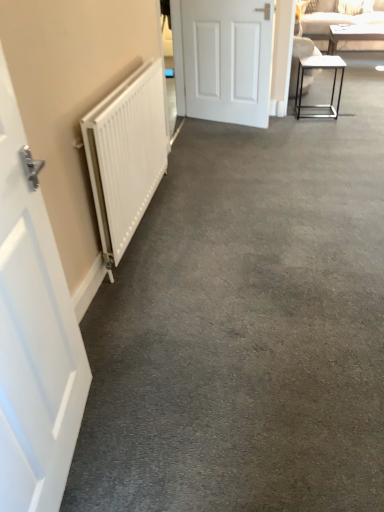
Question: Is white matte door at left, the 2th door when ordered from top to bottom, looking in the opposite direction of white glossy table at upper right, which is counted as the first table, starting from the top?

Choices:
 (A) no
 (B) yes

Answer: (A)

Question: Is white matte door at left, which is the 2th door in back-to-front order, smaller than white glossy table at upper right, the 1th table when ordered from back to front?

Choices:
 (A) no
 (B) yes

Answer: (B)

Question: Is white matte door at left, which is the second door in right-to-left order, bigger than white glossy table at upper right, which is the 2th table from bottom to top?

Choices:
 (A) yes
 (B) no

Answer: (B)

Question: Is white matte door at left, positioned as the 1th door in bottom-to-top order, not close to white glossy table at upper right, marked as the 1th table in a right-to-left arrangement?

Choices:
 (A) no
 (B) yes

Answer: (B)

Question: Does white matte door at left, which is the second door in right-to-left order, come behind white glossy table at upper right, the 2th table positioned from the front?

Choices:
 (A) yes
 (B) no

Answer: (B)

Question: Considering the positions of point (188, 74) and point (350, 45), is point (188, 74) closer or farther from the camera than point (350, 45)?

Choices:
 (A) farther
 (B) closer

Answer: (B)

Question: Considering the positions of white matte door at center, which appears as the second door when viewed from the left, and beige fabric couch at upper right in the image, is white matte door at center, which appears as the second door when viewed from the left, taller or shorter than beige fabric couch at upper right?

Choices:
 (A) tall
 (B) short

Answer: (A)

Question: Considering the positions of white matte door at center, placed as the second door when sorted from bottom to top, and beige fabric couch at upper right in the image, is white matte door at center, placed as the second door when sorted from bottom to top, bigger or smaller than beige fabric couch at upper right?

Choices:
 (A) big
 (B) small

Answer: (B)

Question: Is white matte door at center, the 2th door in the front-to-back sequence, inside or outside of beige fabric couch at upper right?

Choices:
 (A) outside
 (B) inside

Answer: (A)

Question: Is beige fabric couch at upper right spatially inside metallic frame table at right, the second table viewed from the right, or outside of it?

Choices:
 (A) inside
 (B) outside

Answer: (B)

Question: Considering the positions of beige fabric couch at upper right and metallic frame table at right, the first table viewed from the left, in the image, is beige fabric couch at upper right taller or shorter than metallic frame table at right, the first table viewed from the left,?

Choices:
 (A) short
 (B) tall

Answer: (B)

Question: From a real-world perspective, is beige fabric couch at upper right physically located above or below metallic frame table at right, the first table viewed from the left?

Choices:
 (A) below
 (B) above

Answer: (B)

Question: Looking at their shapes, would you say beige fabric couch at upper right is wider or thinner than metallic frame table at right, acting as the 1th table starting from the front?

Choices:
 (A) thin
 (B) wide

Answer: (B)

Question: Considering their positions, is metallic frame table at right, arranged as the first table when ordered from the bottom, located in front of or behind white matte door at left, which is counted as the first door, starting from the left?

Choices:
 (A) behind
 (B) front

Answer: (A)

Question: Is metallic frame table at right, the first table viewed from the left, inside the boundaries of white matte door at left, the 2th door when ordered from top to bottom, or outside?

Choices:
 (A) outside
 (B) inside

Answer: (A)